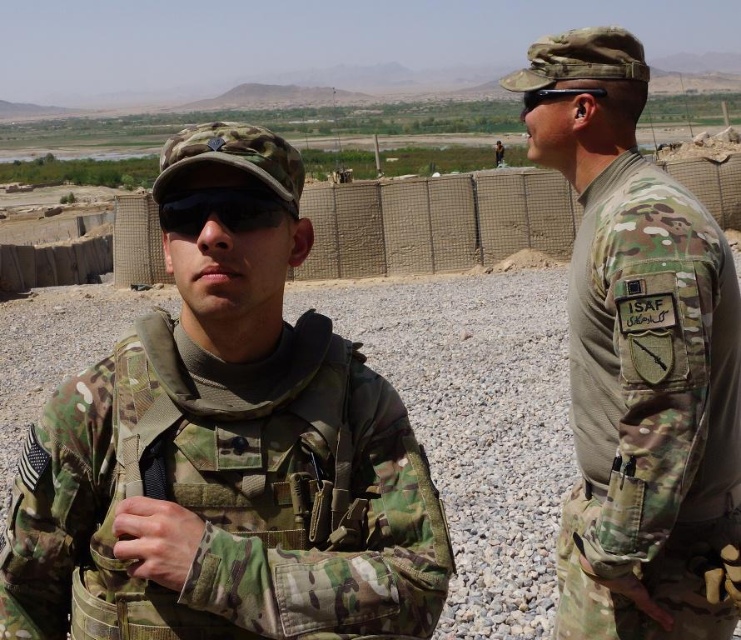
Question: Which of the following is the closest to the observer?

Choices:
 (A) black matte goggles at center
 (B) camouflage uniform at right

Answer: (A)

Question: Is black matte goggles at center positioned behind camouflage uniform at center?

Choices:
 (A) no
 (B) yes

Answer: (A)

Question: Considering the real-world distances, which object is farthest from the camouflage uniform at center?

Choices:
 (A) camo uniform at center
 (B) black matte goggles at center

Answer: (B)

Question: Observing the image, what is the correct spatial positioning of camo uniform at center in reference to black matte goggles at center?

Choices:
 (A) left
 (B) right

Answer: (A)

Question: Based on their relative distances, which object is nearer to the camouflage uniform at center?

Choices:
 (A) camouflage uniform at right
 (B) black matte goggles at center

Answer: (A)

Question: Is the position of camo uniform at center more distant than that of camouflage uniform at center?

Choices:
 (A) yes
 (B) no

Answer: (B)